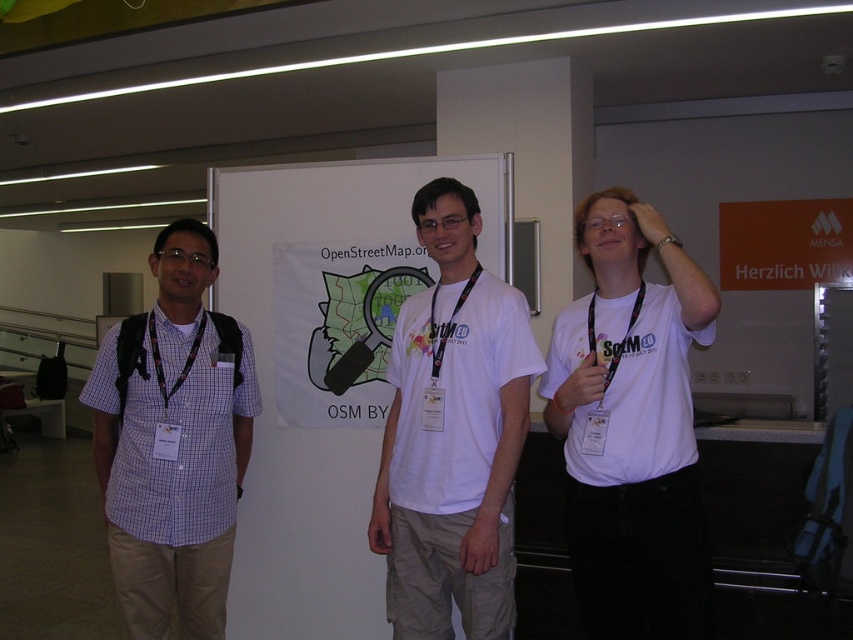
Which of these two, white cotton t-shirt at center or purple checkered shirt at left, stands taller?

Standing taller between the two is white cotton t-shirt at center.

Is white cotton t-shirt at center taller than purple checkered shirt at left?

Yes, white cotton t-shirt at center is taller than purple checkered shirt at left.

Where is `white cotton t-shirt at center`? This screenshot has width=853, height=640. white cotton t-shirt at center is located at coordinates (451, 433).

Image resolution: width=853 pixels, height=640 pixels. What are the coordinates of `white cotton t-shirt at center` in the screenshot? It's located at (451, 433).

Is white matte t-shirt at center thinner than white cotton t-shirt at center?

Yes.

Is point (640, 419) positioned before point (485, 500)?

Yes.

Is point (691, 577) more distant than point (422, 296)?

No, it is in front of (422, 296).

Locate an element on the screen. white matte t-shirt at center is located at coordinates (631, 426).

Is white matte t-shirt at center shorter than purple checkered shirt at left?

Yes, white matte t-shirt at center is shorter than purple checkered shirt at left.

Does white matte t-shirt at center have a greater width compared to purple checkered shirt at left?

No.

Is point (564, 317) farther from viewer compared to point (212, 360)?

No, it is not.

Locate an element on the screen. The height and width of the screenshot is (640, 853). white matte t-shirt at center is located at coordinates (631, 426).